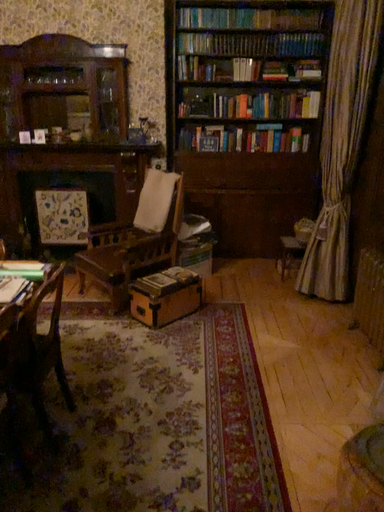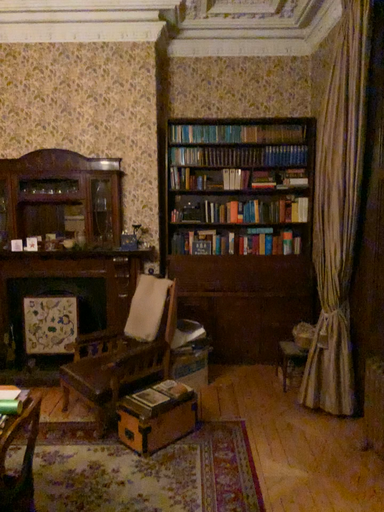
Question: Which way did the camera rotate in the video?

Choices:
 (A) rotated downward
 (B) rotated upward

Answer: (B)